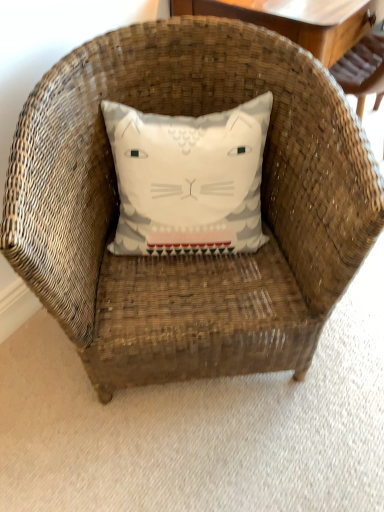
Question: Should I look upward or downward to see white fabric pillow at center?

Choices:
 (A) down
 (B) up

Answer: (B)